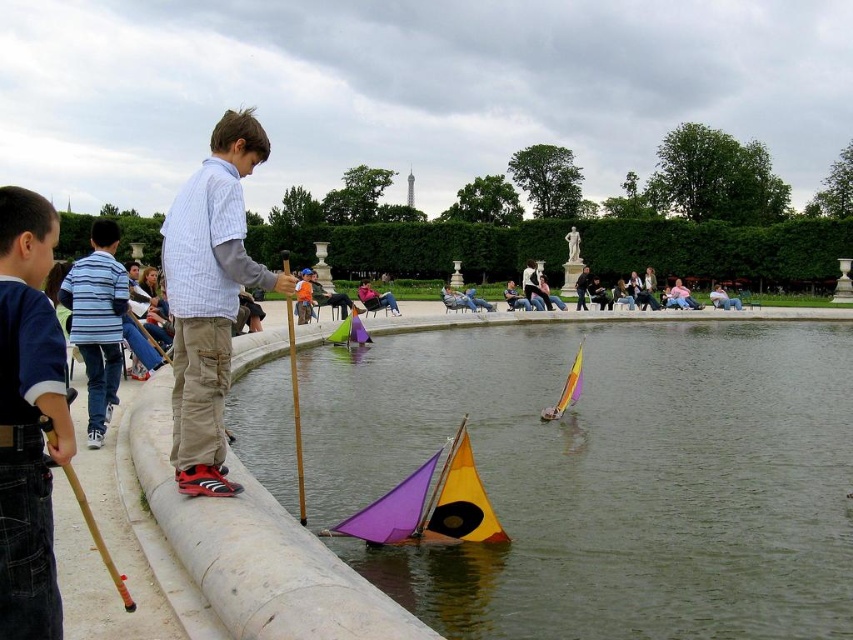
Question: Considering the real-world distances, which object is farthest from the transparent plastic water at center?

Choices:
 (A) striped cotton shirt at left
 (B) rainbow plastic sailboat at center

Answer: (A)

Question: Is blue denim jeans at lower left behind rainbow plastic sailboat at center?

Choices:
 (A) yes
 (B) no

Answer: (B)

Question: Estimate the real-world distances between objects in this image. Which object is farther from the matte plastic sailboat at center?

Choices:
 (A) striped cotton shirt at left
 (B) blue denim jeans at lower left

Answer: (A)

Question: Can you confirm if white striped shirt at center is wider than matte plastic sailboat at center?

Choices:
 (A) yes
 (B) no

Answer: (A)

Question: Among these points, which one is farthest from the camera?

Choices:
 (A) (96, 444)
 (B) (548, 419)
 (C) (39, 220)
 (D) (318, 294)

Answer: (D)

Question: Is transparent plastic water at center thinner than striped cotton shirt at left?

Choices:
 (A) yes
 (B) no

Answer: (B)